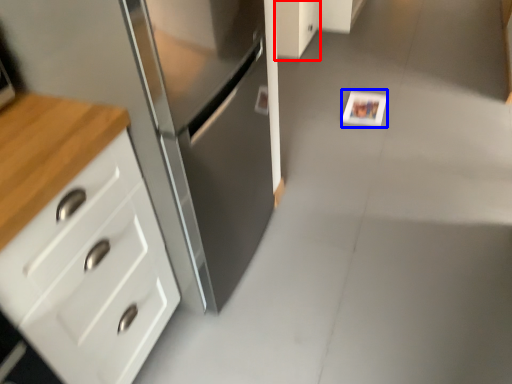
Question: Which of the following is the farthest to the observer, cabinetry (highlighted by a red box) or postcard (highlighted by a blue box)?

Choices:
 (A) cabinetry
 (B) postcard

Answer: (A)